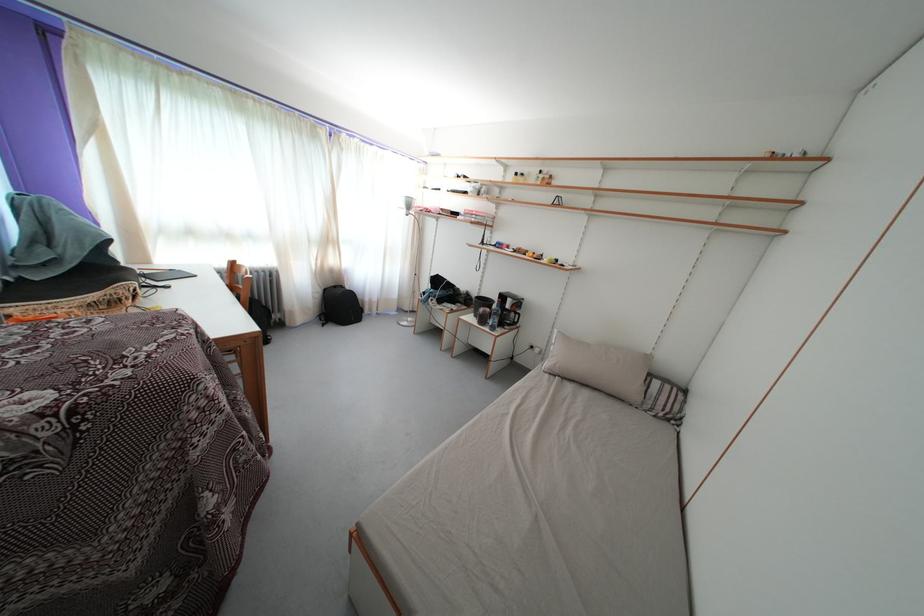
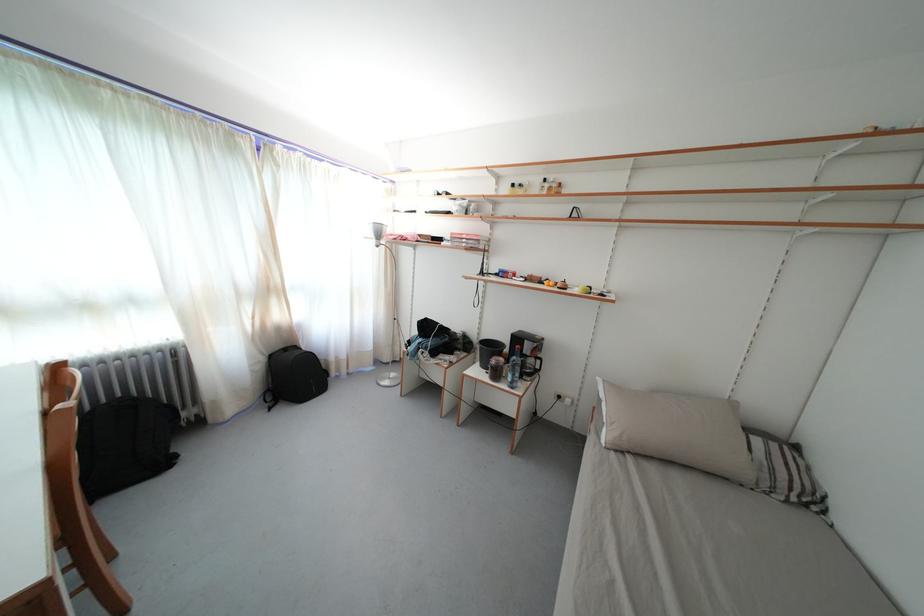
Question: In a continuous first-person perspective shot, in which direction is the camera moving?

Choices:
 (A) Left
 (B) Right
 (C) Forward
 (D) Backward

Answer: (C)